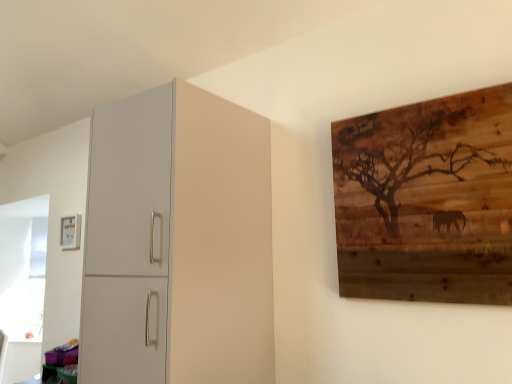
In order to face wooden artwork at upper right, arranged as the 1th picture frame when viewed from the front, should I rotate leftwards or rightwards?

To align with it, rotate right about 20.455°.

This screenshot has height=384, width=512. What do you see at coordinates (178, 242) in the screenshot?
I see `matte white cabinet at left` at bounding box center [178, 242].

The height and width of the screenshot is (384, 512). In order to click on wooden artwork at upper right, arranged as the second picture frame when viewed from the back in this screenshot , I will do `click(426, 200)`.

Would you say wooden artwork at upper right, arranged as the 1th picture frame when viewed from the front, is a long distance from matte white picture frame at upper left, the first picture frame in the back-to-front sequence?

Yes, wooden artwork at upper right, arranged as the 1th picture frame when viewed from the front, and matte white picture frame at upper left, the first picture frame in the back-to-front sequence, are quite far apart.

From a real-world perspective, is wooden artwork at upper right, the 1th picture frame from the right, above or below matte white picture frame at upper left, the 1th picture frame when ordered from left to right?

wooden artwork at upper right, the 1th picture frame from the right, is situated lower than matte white picture frame at upper left, the 1th picture frame when ordered from left to right, in the real world.

From the image's perspective, is wooden artwork at upper right, acting as the 2th picture frame starting from the left, over matte white picture frame at upper left, which is counted as the 2th picture frame, starting from the front?

Correct, wooden artwork at upper right, acting as the 2th picture frame starting from the left, appears higher than matte white picture frame at upper left, which is counted as the 2th picture frame, starting from the front, in the image.

Which object is closer to the camera, wooden artwork at upper right, acting as the 2th picture frame starting from the left, or matte white picture frame at upper left, which is counted as the 2th picture frame, starting from the front?

wooden artwork at upper right, acting as the 2th picture frame starting from the left, is closer to the camera.

In order to click on picture frame that appears on the right of matte white picture frame at upper left, the 1th picture frame when ordered from left to right in this screenshot , I will do `click(426, 200)`.

From the image's perspective, which one is positioned lower, matte white picture frame at upper left, marked as the second picture frame in a right-to-left arrangement, or wooden artwork at upper right, the 1th picture frame from the right?

matte white picture frame at upper left, marked as the second picture frame in a right-to-left arrangement, is shown below in the image.

Are matte white picture frame at upper left, the first picture frame in the back-to-front sequence, and wooden artwork at upper right, acting as the 2th picture frame starting from the left, located far from each other?

Yes.

From a real-world perspective, between matte white picture frame at upper left, which is counted as the 2th picture frame, starting from the front, and wooden artwork at upper right, the 1th picture frame from the right, who is vertically lower?

wooden artwork at upper right, the 1th picture frame from the right, from a real-world perspective.

Between matte white cabinet at left and wooden artwork at upper right, the 1th picture frame from the right, which one appears on the left side from the viewer's perspective?

matte white cabinet at left.

Is wooden artwork at upper right, acting as the 2th picture frame starting from the left, at the back of matte white cabinet at left?

No, matte white cabinet at left is not facing the opposite direction of wooden artwork at upper right, acting as the 2th picture frame starting from the left.

From a real-world perspective, is matte white cabinet at left positioned over wooden artwork at upper right, arranged as the second picture frame when viewed from the back, based on gravity?

No, from a real-world perspective, matte white cabinet at left is not over wooden artwork at upper right, arranged as the second picture frame when viewed from the back

Is matte white cabinet at left touching wooden artwork at upper right, arranged as the second picture frame when viewed from the back?

No, matte white cabinet at left is not touching wooden artwork at upper right, arranged as the second picture frame when viewed from the back.

Is matte white picture frame at upper left, the first picture frame in the back-to-front sequence, at the back of matte white cabinet at left?

No, matte white cabinet at left is not facing away from matte white picture frame at upper left, the first picture frame in the back-to-front sequence.

How much distance is there between matte white cabinet at left and matte white picture frame at upper left, the first picture frame in the back-to-front sequence?

The distance of matte white cabinet at left from matte white picture frame at upper left, the first picture frame in the back-to-front sequence, is 1.58 meters.

Considering the sizes of objects matte white cabinet at left and matte white picture frame at upper left, marked as the second picture frame in a right-to-left arrangement, in the image provided, who is taller, matte white cabinet at left or matte white picture frame at upper left, marked as the second picture frame in a right-to-left arrangement,?

matte white cabinet at left.

From the image's perspective, is matte white cabinet at left over matte white picture frame at upper left, the 1th picture frame when ordered from left to right?

Indeed, from the image's perspective, matte white cabinet at left is shown above matte white picture frame at upper left, the 1th picture frame when ordered from left to right.

Which point is more forward, (63, 246) or (104, 301)?

Point (104, 301)

Find the location of a particular element. The image size is (512, 384). picture frame that is the 2nd object above the matte white cabinet at left (from a real-world perspective) is located at coordinates (70, 232).

From the picture: From the image's perspective, relative to matte white cabinet at left, is matte white picture frame at upper left, marked as the second picture frame in a right-to-left arrangement, above or below?

Based on their image positions, matte white picture frame at upper left, marked as the second picture frame in a right-to-left arrangement, is located beneath matte white cabinet at left.

From a real-world perspective, does matte white picture frame at upper left, the first picture frame in the back-to-front sequence, stand above matte white cabinet at left?

Yes, from a real-world perspective, matte white picture frame at upper left, the first picture frame in the back-to-front sequence, is on top of matte white cabinet at left.

Measure the distance from wooden artwork at upper right, acting as the 2th picture frame starting from the left, to matte white cabinet at left.

They are 27.10 inches apart.

Image resolution: width=512 pixels, height=384 pixels. Identify the location of picture frame on the right of matte white cabinet at left. (426, 200).

Based on the photo, is wooden artwork at upper right, arranged as the 1th picture frame when viewed from the front, smaller than matte white cabinet at left?

Yes.

Does wooden artwork at upper right, arranged as the 1th picture frame when viewed from the front, turn towards matte white cabinet at left?

No, wooden artwork at upper right, arranged as the 1th picture frame when viewed from the front, is not turned towards matte white cabinet at left.

Where is `picture frame located above the matte white picture frame at upper left, the 1th picture frame when ordered from left to right (from the image's perspective)`? picture frame located above the matte white picture frame at upper left, the 1th picture frame when ordered from left to right (from the image's perspective) is located at coordinates (426, 200).

The height and width of the screenshot is (384, 512). There is a wooden artwork at upper right, arranged as the second picture frame when viewed from the back. Find the location of `picture frame above it (from a real-world perspective)`. picture frame above it (from a real-world perspective) is located at coordinates (70, 232).

Estimate the real-world distances between objects in this image. Which object is further from matte white cabinet at left, matte white picture frame at upper left, the 1th picture frame when ordered from left to right, or wooden artwork at upper right, arranged as the 1th picture frame when viewed from the front?

matte white picture frame at upper left, the 1th picture frame when ordered from left to right.

Considering their positions, is matte white cabinet at left positioned closer to matte white picture frame at upper left, marked as the second picture frame in a right-to-left arrangement, than wooden artwork at upper right, acting as the 2th picture frame starting from the left?

matte white cabinet at left lies closer to matte white picture frame at upper left, marked as the second picture frame in a right-to-left arrangement, than the other object.

When comparing their distances from wooden artwork at upper right, the 1th picture frame from the right, does matte white cabinet at left or matte white picture frame at upper left, the 1th picture frame when ordered from left to right, seem further?

The object further to wooden artwork at upper right, the 1th picture frame from the right, is matte white picture frame at upper left, the 1th picture frame when ordered from left to right.

Estimate the real-world distances between objects in this image. Which object is further from matte white cabinet at left, wooden artwork at upper right, arranged as the second picture frame when viewed from the back, or matte white picture frame at upper left, marked as the second picture frame in a right-to-left arrangement?

matte white picture frame at upper left, marked as the second picture frame in a right-to-left arrangement, is further to matte white cabinet at left.

When comparing their distances from wooden artwork at upper right, arranged as the 1th picture frame when viewed from the front, does matte white picture frame at upper left, marked as the second picture frame in a right-to-left arrangement, or matte white cabinet at left seem closer?

matte white cabinet at left lies closer to wooden artwork at upper right, arranged as the 1th picture frame when viewed from the front, than the other object.

Looking at the image, which one is located further to matte white picture frame at upper left, which is counted as the 2th picture frame, starting from the front, wooden artwork at upper right, arranged as the 1th picture frame when viewed from the front, or matte white cabinet at left?

The object further to matte white picture frame at upper left, which is counted as the 2th picture frame, starting from the front, is wooden artwork at upper right, arranged as the 1th picture frame when viewed from the front.

Where is `cupboard between matte white picture frame at upper left, the first picture frame in the back-to-front sequence, and wooden artwork at upper right, the 1th picture frame from the right, from left to right`? The image size is (512, 384). cupboard between matte white picture frame at upper left, the first picture frame in the back-to-front sequence, and wooden artwork at upper right, the 1th picture frame from the right, from left to right is located at coordinates (178, 242).